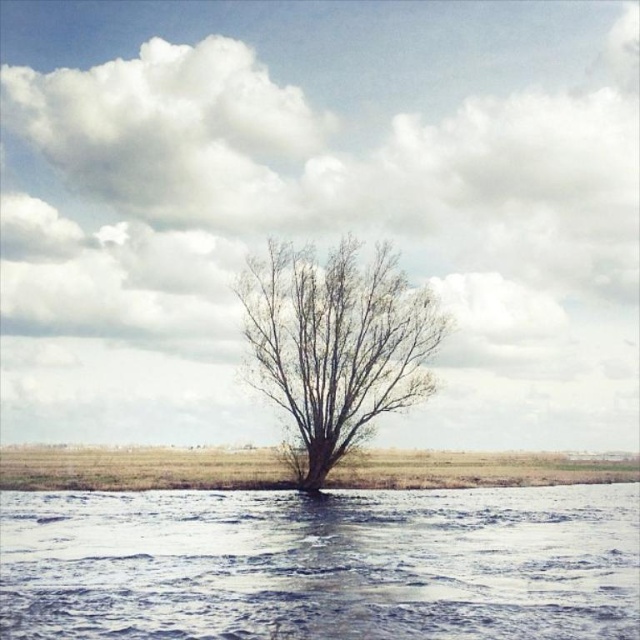
You are a bird looking for a place to perch. You see the bare branches at center and brown grass at center. Which one is closer to the left side of the scene?

The bare branches at center is to the left of brown grass at center, so the bare branches at center is closer to the left side of the scene.

You are a hiker who wants to cross the body of water in the scene. You see the translucent ice at lower center and the brown grass at center. Which surface is safer to walk on?

The brown grass at center is safer to walk on because the translucent ice at lower center is smaller than brown grass at center, indicating it may be thinner and less stable.

You are an observer standing at the edge of the water in the scene. You notice the translucent ice at lower center and the bare branches at center. Which object is closer to the water surface?

The translucent ice at lower center is positioned under the bare branches at center, so the ice is closer to the water surface than the branches.